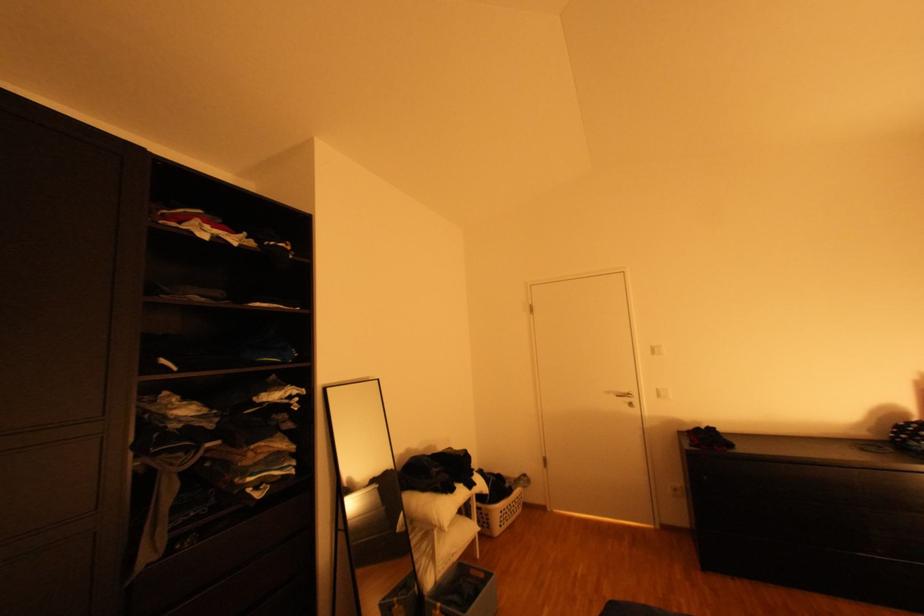
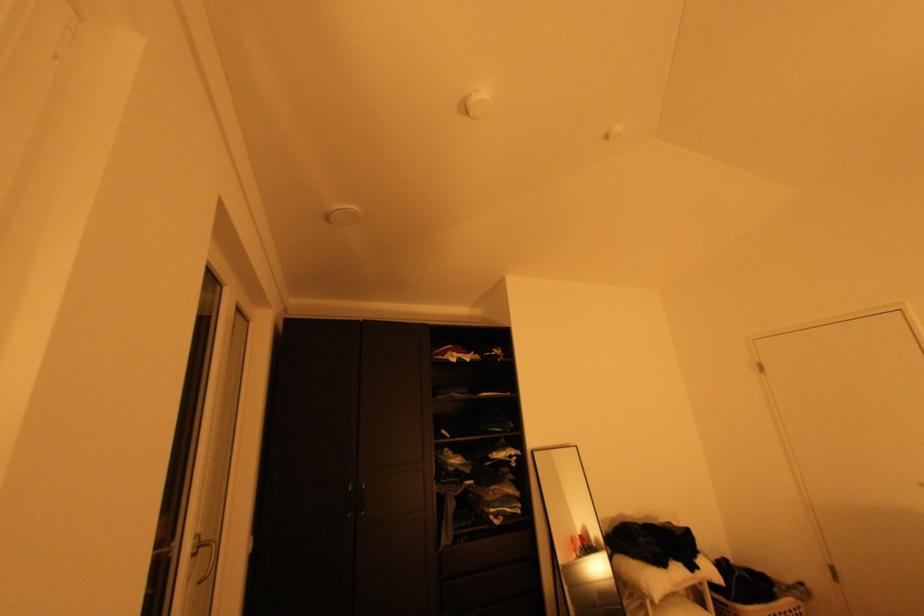
Question: The camera is either moving clockwise (left) or counter-clockwise (right) around the object. The first image is from the beginning of the video and the second image is from the end. Is the camera moving left or right when shooting the video?

Choices:
 (A) Left
 (B) Right

Answer: (B)